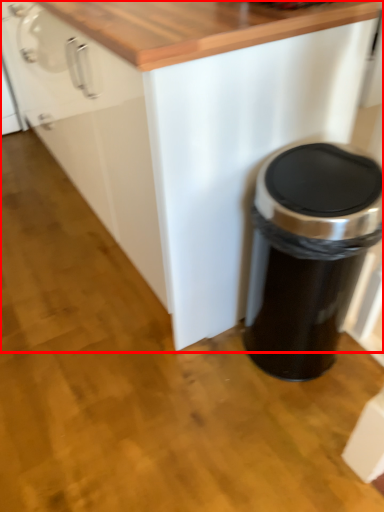
Question: From the image, what is the correct spatial relationship of cabinetry (annotated by the red box) in relation to waste container?

Choices:
 (A) right
 (B) left

Answer: (B)